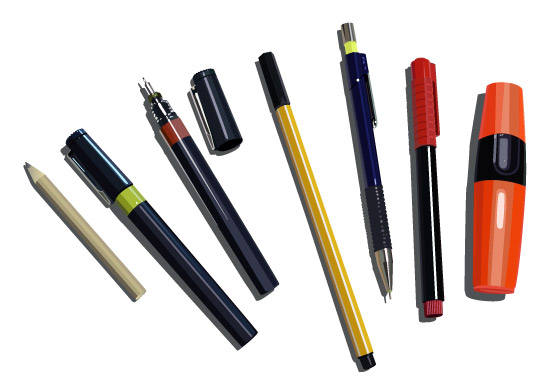
Locate an element on the screen. writing utensils is located at coordinates (98, 243), (152, 236), (214, 212), (309, 198), (372, 191), (430, 190), (493, 200).